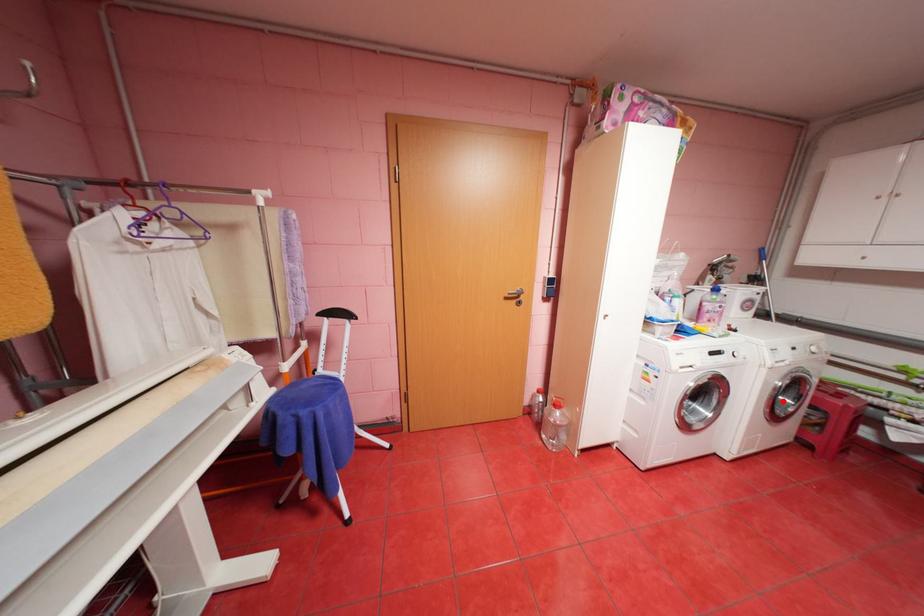
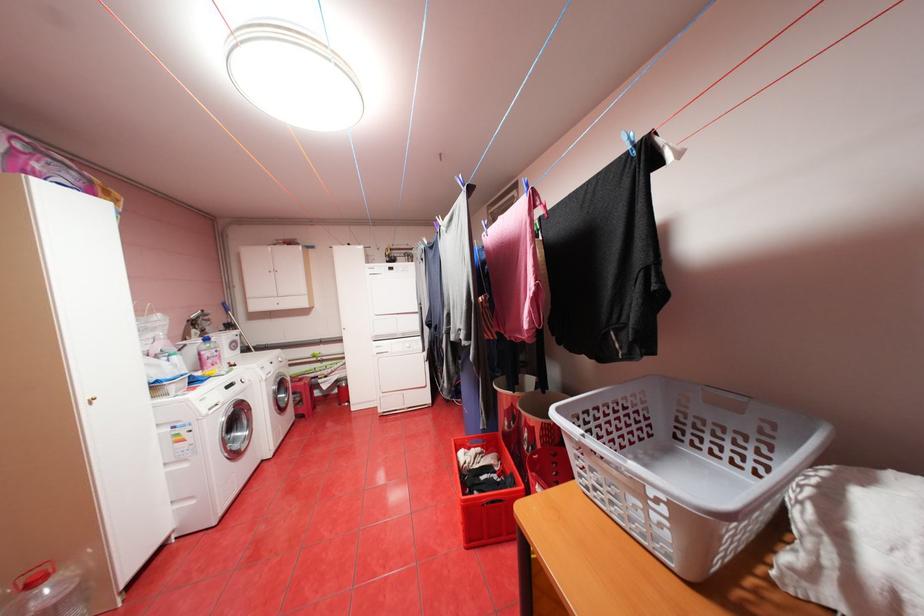
In the second image, find the point that corresponds to the highlighted location in the first image.

(286, 400)